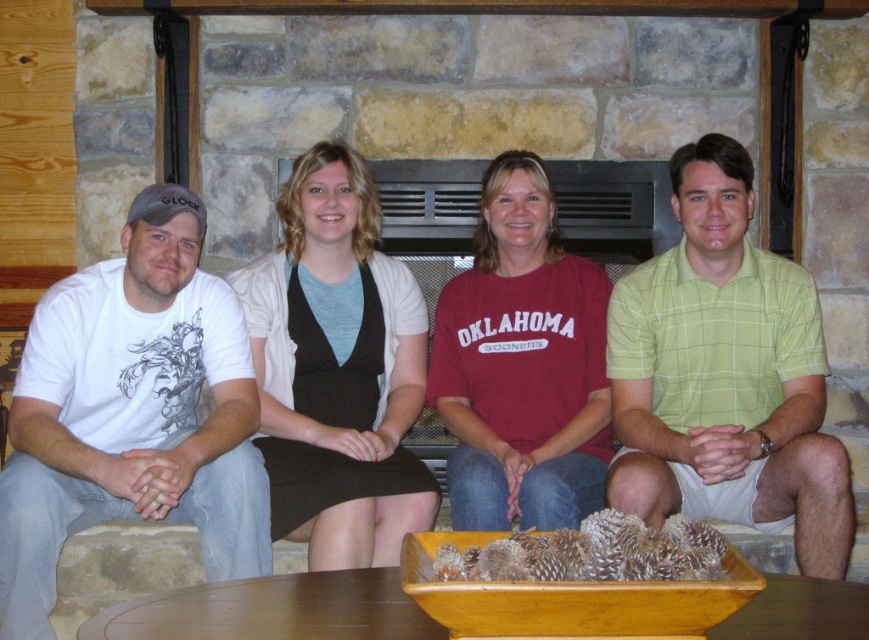
Does green plaid shirt at right appear on the right side of black matte dress at center?

Yes, green plaid shirt at right is to the right of black matte dress at center.

Can you confirm if green plaid shirt at right is smaller than black matte dress at center?

Indeed, green plaid shirt at right has a smaller size compared to black matte dress at center.

Does point (717, 472) lie in front of point (393, 304)?

Yes, point (717, 472) is in front of point (393, 304).

This screenshot has height=640, width=869. Identify the location of green plaid shirt at right. coord(725,376).

Can you confirm if white matte t-shirt at left is thinner than black matte dress at center?

No.

Where is `white matte t-shirt at left`? The image size is (869, 640). white matte t-shirt at left is located at coordinates (131, 412).

Locate an element on the screen. This screenshot has height=640, width=869. white matte t-shirt at left is located at coordinates (131, 412).

Can you confirm if white matte t-shirt at left is smaller than maroon cotton shirt at center?

Incorrect, white matte t-shirt at left is not smaller in size than maroon cotton shirt at center.

Does point (101, 420) lie behind point (552, 456)?

No, (101, 420) is closer to viewer.

The width and height of the screenshot is (869, 640). I want to click on white matte t-shirt at left, so click(131, 412).